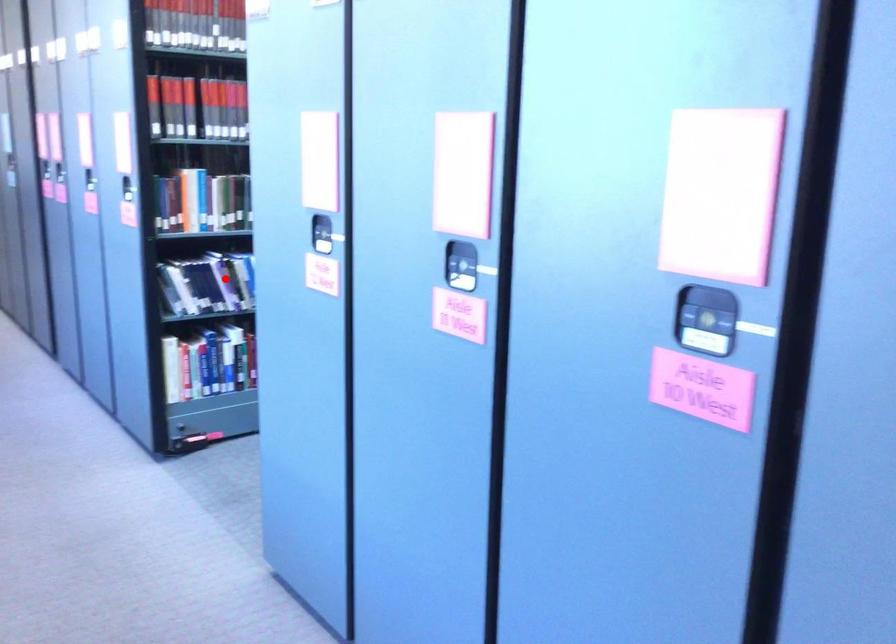
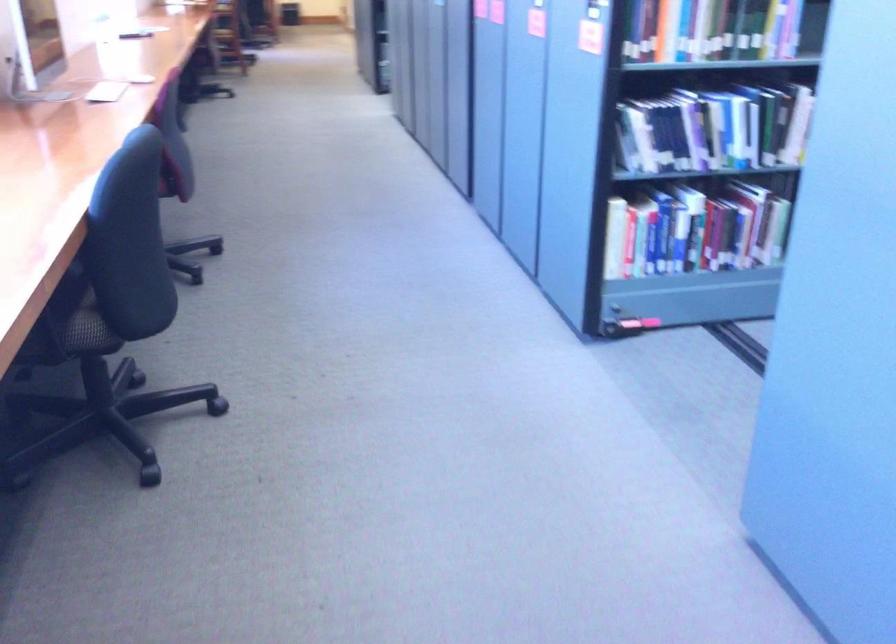
Question: I am providing you with two images of the same scene from different viewpoints. In image1, a red point is highlighted. Considering the same 3D point in image2, which of the following is correct?

Choices:
 (A) It is closer
 (B) It is farther

Answer: (A)